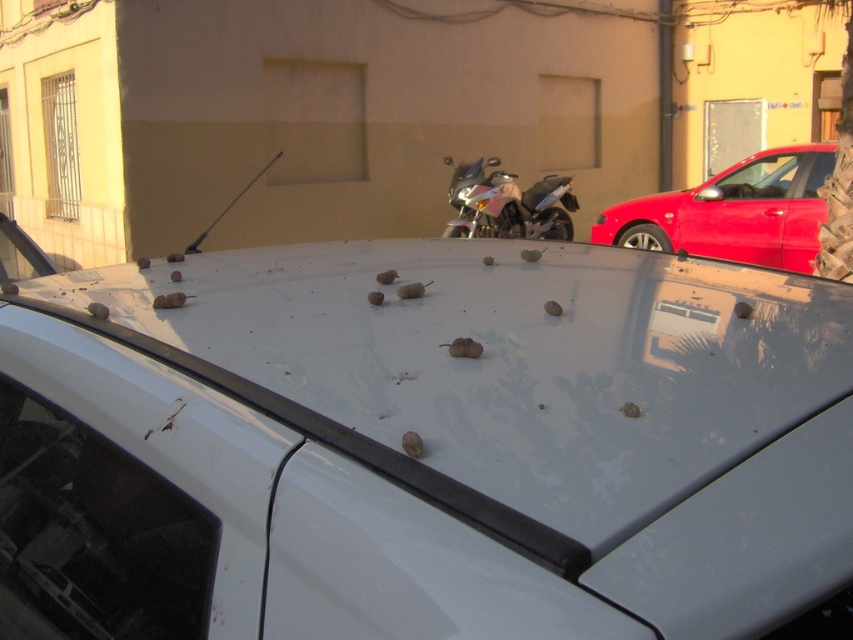
You are a delivery person trying to park your shiny metallic motorcycle at center between the shiny red car at upper right and the beige building. Can you fit the motorcycle between them without touching either?

The shiny red car at upper right is located below the shiny metallic motorcycle at center, so there is space between them. However, since the motorcycle is already at the center and the car is below it, the motorcycle might already be positioned between the car and the building. To determine if there is enough space, you would need to consider the distance between the motorcycle and both the car and the building. Since the description does not provide specific measurements, it is unclear if the space is too

You are a delivery person trying to park your shiny metallic motorcycle at center behind the white glossy car at center. Can you park the motorcycle behind the car without moving the car?

The white glossy car at center is in front of the shiny metallic motorcycle at center, so the motorcycle is already behind the car. Therefore, there is no need to move the car to park the motorcycle behind it.